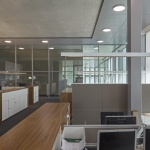
The width and height of the screenshot is (150, 150). I want to click on white cabinets, so click(8, 97).